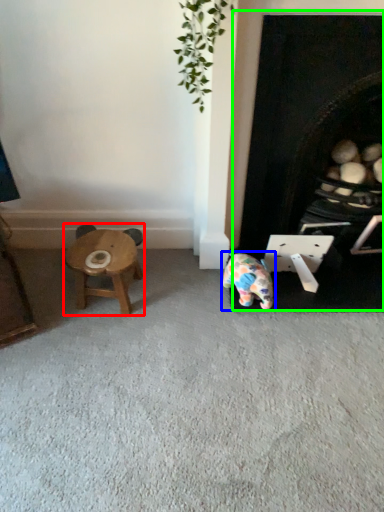
Question: Based on their relative distances, which object is nearer to stool (highlighted by a red box)? Choose from toy (highlighted by a blue box) and fireplace (highlighted by a green box).

Choices:
 (A) toy
 (B) fireplace

Answer: (A)